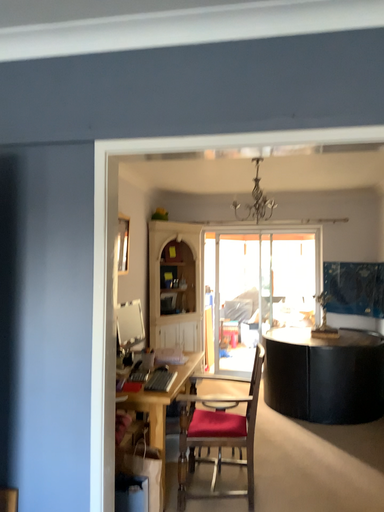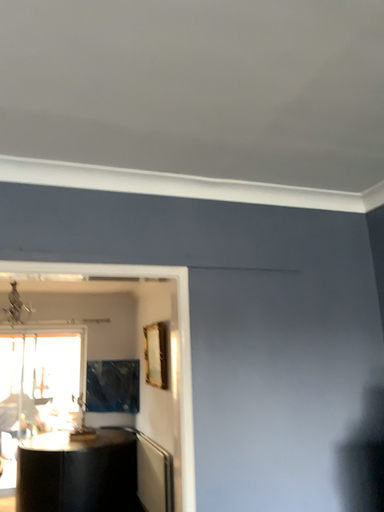
Question: How did the camera likely rotate when shooting the video?

Choices:
 (A) rotated left
 (B) rotated right

Answer: (B)